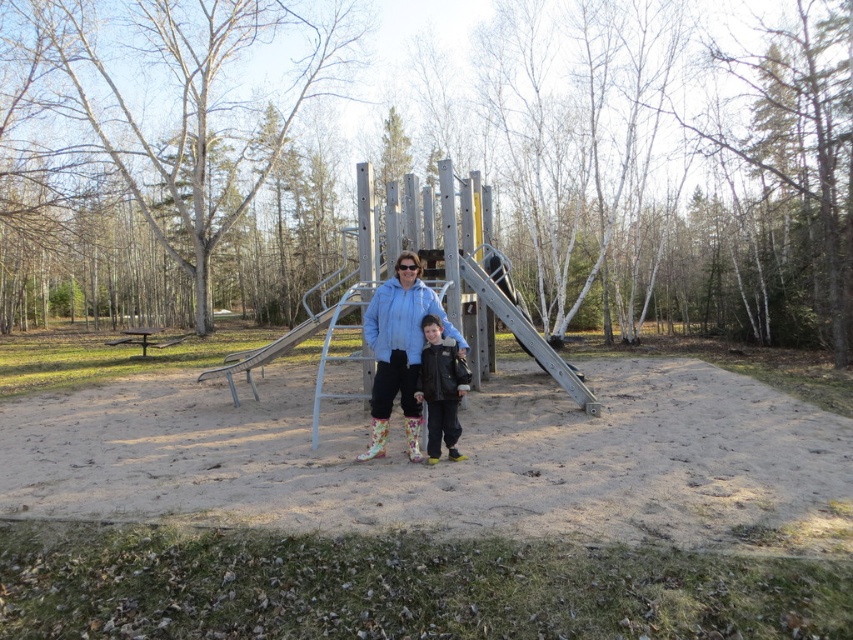
Question: Estimate the real-world distances between objects in this image. Which object is farther from the metallic silver slide at center?

Choices:
 (A) matte blue jacket at center
 (B) black leather jacket at center

Answer: (B)

Question: Among these objects, which one is farthest from the camera?

Choices:
 (A) black leather jacket at center
 (B) metallic silver slide at center
 (C) matte blue jacket at center

Answer: (B)

Question: Does matte blue jacket at center appear over black leather jacket at center?

Choices:
 (A) yes
 (B) no

Answer: (A)

Question: Is matte blue jacket at center further to the viewer compared to metallic silver slide at center?

Choices:
 (A) yes
 (B) no

Answer: (B)

Question: Among these objects, which one is nearest to the camera?

Choices:
 (A) black leather jacket at center
 (B) matte blue jacket at center

Answer: (A)

Question: Can you confirm if matte blue jacket at center is positioned to the left of black leather jacket at center?

Choices:
 (A) no
 (B) yes

Answer: (B)